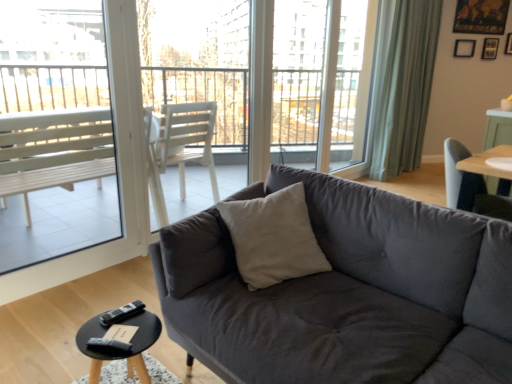
Question: Is black plastic remote at lower left, the first remote from the front, wider than wooden picture frame at upper right, which is counted as the 2th picture frame, starting from the left?

Choices:
 (A) yes
 (B) no

Answer: (A)

Question: From a real-world perspective, is black plastic remote at lower left, which is the second remote in back-to-front order, physically above wooden picture frame at upper right, which is counted as the 2th picture frame, starting from the left?

Choices:
 (A) yes
 (B) no

Answer: (B)

Question: Can you confirm if black plastic remote at lower left, marked as the first remote in a bottom-to-top arrangement, is positioned to the left of wooden picture frame at upper right, which is counted as the 2th picture frame, starting from the left?

Choices:
 (A) no
 (B) yes

Answer: (B)

Question: Is black plastic remote at lower left, which is the second remote from top to bottom, facing away from wooden picture frame at upper right, which is counted as the 2th picture frame, starting from the left?

Choices:
 (A) yes
 (B) no

Answer: (B)

Question: From the image's perspective, is black plastic remote at lower left, the first remote from the front, beneath wooden picture frame at upper right, which is counted as the 2th picture frame, starting from the left?

Choices:
 (A) yes
 (B) no

Answer: (A)

Question: Does black plastic remote at lower left, which is the second remote in back-to-front order, turn towards wooden picture frame at upper right, the 1th picture frame in the right-to-left sequence?

Choices:
 (A) no
 (B) yes

Answer: (A)

Question: Can you confirm if dark gray fabric couch at center is smaller than black wood coffee table at lower left?

Choices:
 (A) no
 (B) yes

Answer: (A)

Question: Is dark gray fabric couch at center wider than black wood coffee table at lower left?

Choices:
 (A) no
 (B) yes

Answer: (B)

Question: From a real-world perspective, is dark gray fabric couch at center physically below black wood coffee table at lower left?

Choices:
 (A) yes
 (B) no

Answer: (B)

Question: Would you consider dark gray fabric couch at center to be distant from black wood coffee table at lower left?

Choices:
 (A) no
 (B) yes

Answer: (A)

Question: From the image's perspective, is dark gray fabric couch at center located beneath black wood coffee table at lower left?

Choices:
 (A) no
 (B) yes

Answer: (A)

Question: Is dark gray fabric couch at center touching black wood coffee table at lower left?

Choices:
 (A) yes
 (B) no

Answer: (B)

Question: Considering the relative sizes of black wood coffee table at lower left and black matte picture frame at upper right, marked as the 1th picture frame in a left-to-right arrangement, in the image provided, is black wood coffee table at lower left bigger than black matte picture frame at upper right, marked as the 1th picture frame in a left-to-right arrangement,?

Choices:
 (A) no
 (B) yes

Answer: (B)